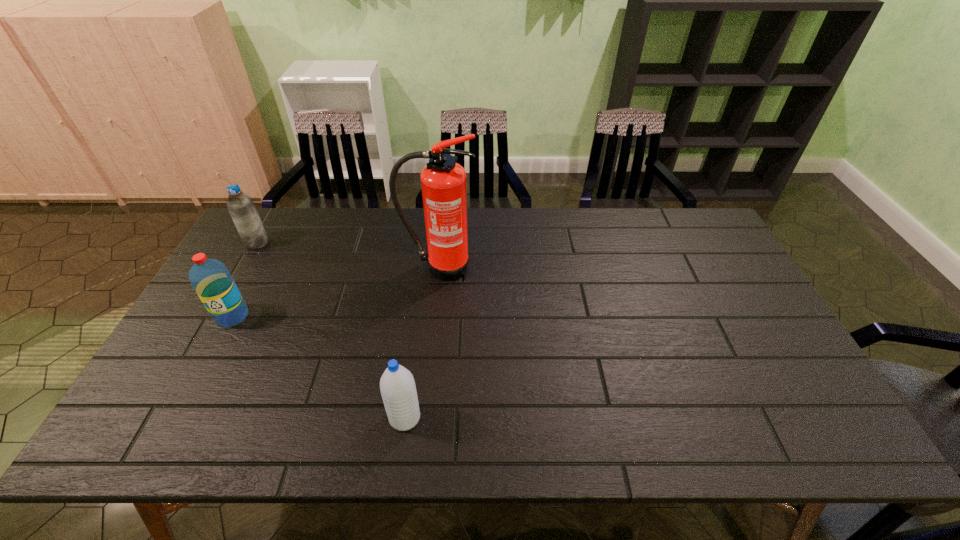
Identify which water bottle is the second closest to the second farthest water bottle. Please provide its 2D coordinates. Your answer should be formatted as a tuple, i.e. [(x, y)], where the tuple contains the x and y coordinates of a point satisfying the conditions above.

[(397, 385)]

You are a GUI agent. You are given a task and a screenshot of the screen. Output one action in this format:
    pyautogui.click(x=<x>, y=<y>)
    Task: Click on the blank area in the image that satisfies the following two spatial constraints: 1. on the front side of the farthest object; 2. on the left side of the nearest object
    
    Given the screenshot: What is the action you would take?
    pyautogui.click(x=157, y=417)

Locate an element on the screen. vacant point that satisfies the following two spatial constraints: 1. on the front label of the nearest object; 2. on the right side of the second farthest water bottle is located at coordinates (179, 417).